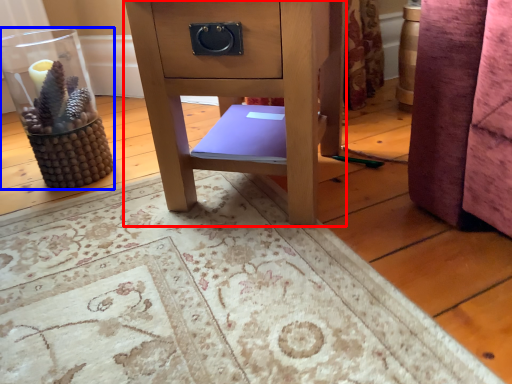
Question: Which object is further to the camera taking this photo, furniture (highlighted by a red box) or glass vase (highlighted by a blue box)?

Choices:
 (A) furniture
 (B) glass vase

Answer: (B)